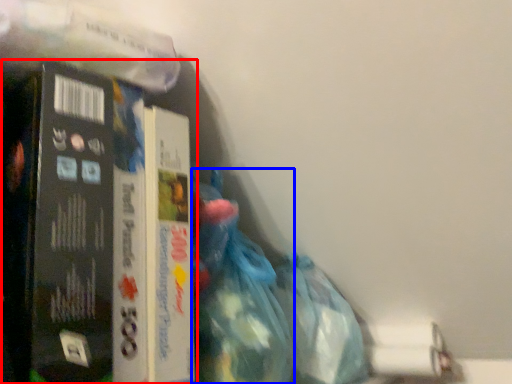
Question: Among these objects, which one is farthest to the camera, book (highlighted by a red box) or waste (highlighted by a blue box)?

Choices:
 (A) book
 (B) waste

Answer: (B)